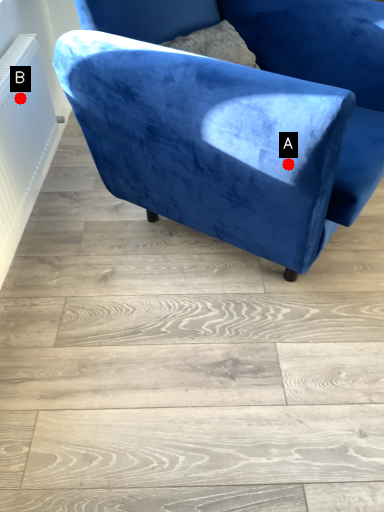
Question: Two points are circled on the image, labeled by A and B beside each circle. Among these points, which one is farthest from the camera?

Choices:
 (A) A is further
 (B) B is further

Answer: (B)